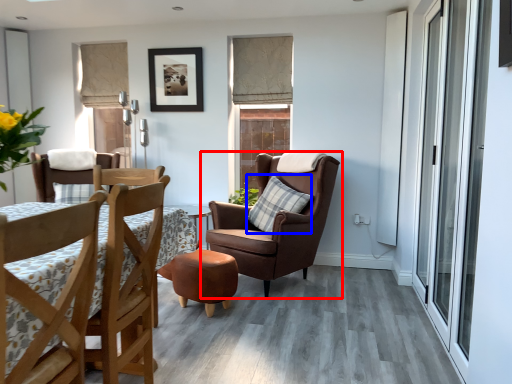
Question: Which object is closer to the camera taking this photo, chair (highlighted by a red box) or pillow (highlighted by a blue box)?

Choices:
 (A) chair
 (B) pillow

Answer: (A)